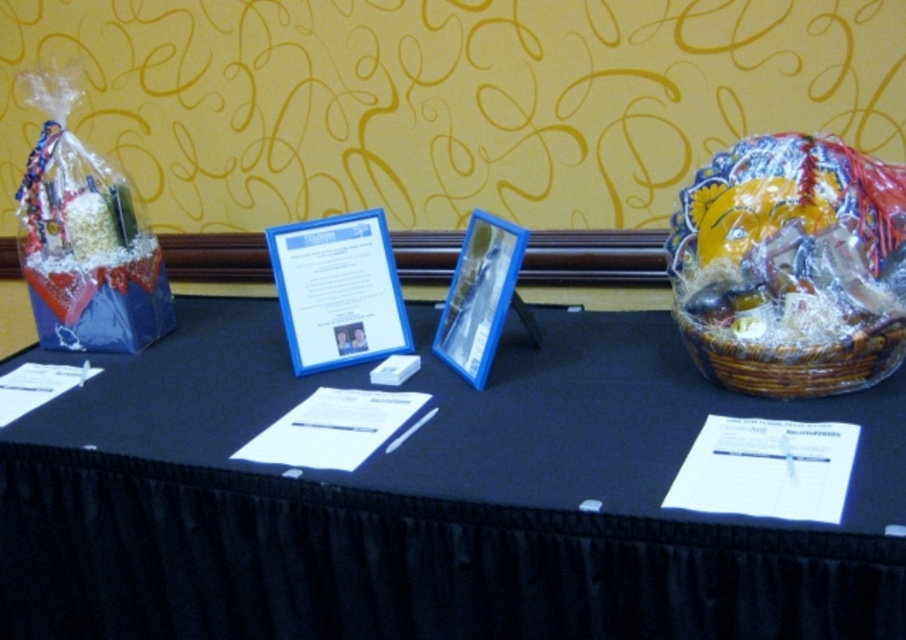
Question: Is clear plastic frame at center below woven brown basket at right?

Choices:
 (A) yes
 (B) no

Answer: (B)

Question: Which point is closer to the camera?

Choices:
 (A) (119, 365)
 (B) (413, 129)
 (C) (840, 392)

Answer: (C)

Question: Is clear plastic frame at center below woven brown basket at right?

Choices:
 (A) no
 (B) yes

Answer: (A)

Question: Is black fabric table at center bigger than woven brown basket at right?

Choices:
 (A) no
 (B) yes

Answer: (B)

Question: Among these points, which one is nearest to the camera?

Choices:
 (A) (758, 380)
 (B) (566, 346)

Answer: (A)

Question: Which point is closer to the camera taking this photo?

Choices:
 (A) (381, 598)
 (B) (582, 10)

Answer: (A)